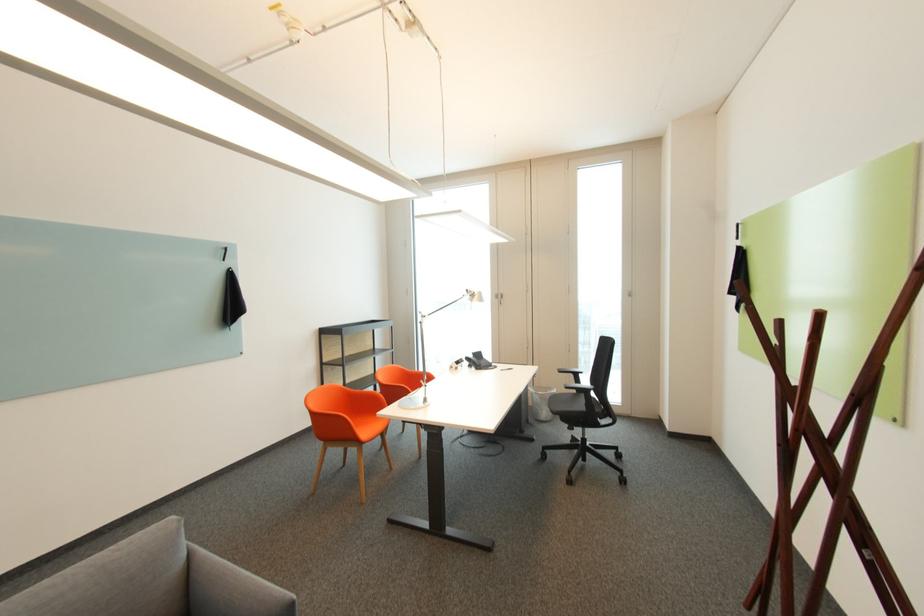
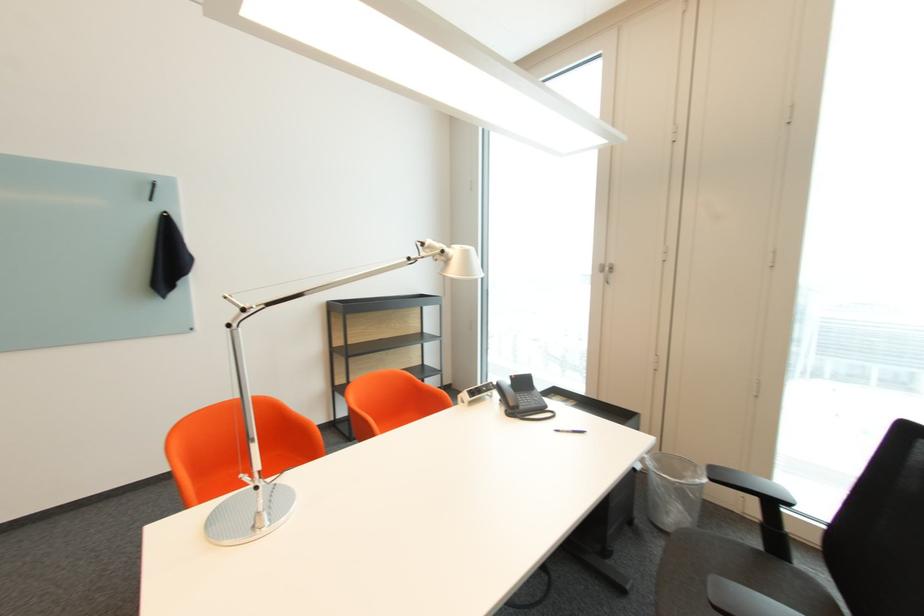
Where in the second image is the point corresponding to pixel 475 360 from the first image?

(505, 387)